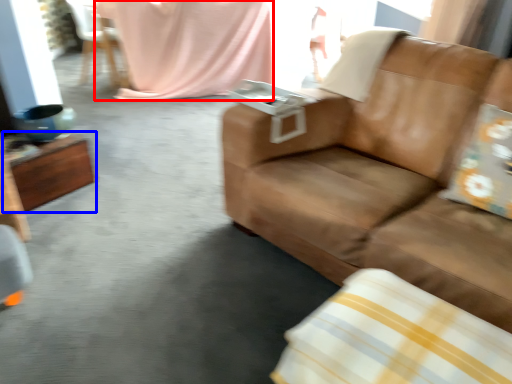
Question: Which object appears closest to the camera in this image, blanket (highlighted by a red box) or table (highlighted by a blue box)?

Choices:
 (A) blanket
 (B) table

Answer: (B)